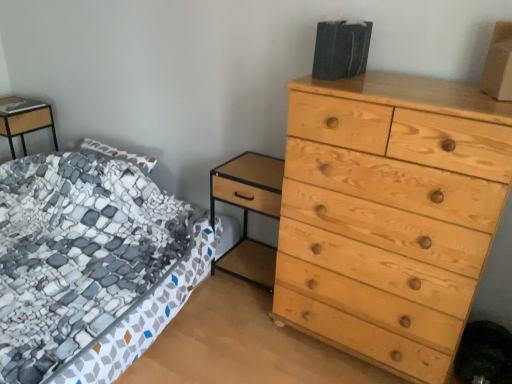
Question: Does matte wood nightstand at left, the second nightstand viewed from the right, have a lesser height compared to light wood/texture nightstand at center, the 1th nightstand viewed from the right?

Choices:
 (A) yes
 (B) no

Answer: (A)

Question: Is matte wood nightstand at left, arranged as the 1th nightstand when viewed from the top, to the right of light wood/texture nightstand at center, the 1th nightstand viewed from the right, from the viewer's perspective?

Choices:
 (A) no
 (B) yes

Answer: (A)

Question: Can you confirm if matte wood nightstand at left, the second nightstand viewed from the right, is bigger than light wood/texture nightstand at center, the second nightstand when ordered from left to right?

Choices:
 (A) no
 (B) yes

Answer: (A)

Question: Does matte wood nightstand at left, the second nightstand viewed from the right, have a greater width compared to light wood/texture nightstand at center, positioned as the first nightstand in bottom-to-top order?

Choices:
 (A) yes
 (B) no

Answer: (A)

Question: Can you confirm if matte wood nightstand at left, arranged as the 1th nightstand when viewed from the back, is thinner than light wood/texture nightstand at center, the second nightstand when ordered from left to right?

Choices:
 (A) yes
 (B) no

Answer: (B)

Question: From the image's perspective, is light wood/texture nightstand at center, the 2th nightstand viewed from the back, located above or below light wood chest of drawers at right?

Choices:
 (A) above
 (B) below

Answer: (B)

Question: Considering the positions of point (247, 173) and point (415, 162), is point (247, 173) closer or farther from the camera than point (415, 162)?

Choices:
 (A) farther
 (B) closer

Answer: (A)

Question: Is light wood/texture nightstand at center, positioned as the first nightstand in bottom-to-top order, bigger or smaller than light wood chest of drawers at right?

Choices:
 (A) small
 (B) big

Answer: (A)

Question: Is light wood/texture nightstand at center, positioned as the first nightstand in bottom-to-top order, inside the boundaries of light wood chest of drawers at right, or outside?

Choices:
 (A) outside
 (B) inside

Answer: (A)

Question: Considering the positions of brown cardboard box at upper right and light wood/texture nightstand at center, the second nightstand when ordered from left to right, in the image, is brown cardboard box at upper right wider or thinner than light wood/texture nightstand at center, the second nightstand when ordered from left to right,?

Choices:
 (A) wide
 (B) thin

Answer: (B)

Question: Looking at the image, does brown cardboard box at upper right seem bigger or smaller compared to light wood/texture nightstand at center, the second nightstand when ordered from left to right?

Choices:
 (A) big
 (B) small

Answer: (B)

Question: Considering their positions, is brown cardboard box at upper right located in front of or behind light wood/texture nightstand at center, which appears as the first nightstand when viewed from the front?

Choices:
 (A) front
 (B) behind

Answer: (A)

Question: Do you think brown cardboard box at upper right is within light wood/texture nightstand at center, the second nightstand from the top, or outside of it?

Choices:
 (A) inside
 (B) outside

Answer: (B)

Question: Would you say light wood chest of drawers at right is inside or outside patterned fabric bed at left?

Choices:
 (A) outside
 (B) inside

Answer: (A)

Question: Considering the positions of light wood chest of drawers at right and patterned fabric bed at left in the image, is light wood chest of drawers at right wider or thinner than patterned fabric bed at left?

Choices:
 (A) wide
 (B) thin

Answer: (B)